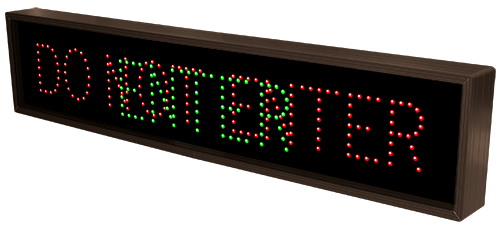
Locate an element on the screen. green lights (circles) is located at coordinates click(x=196, y=105).